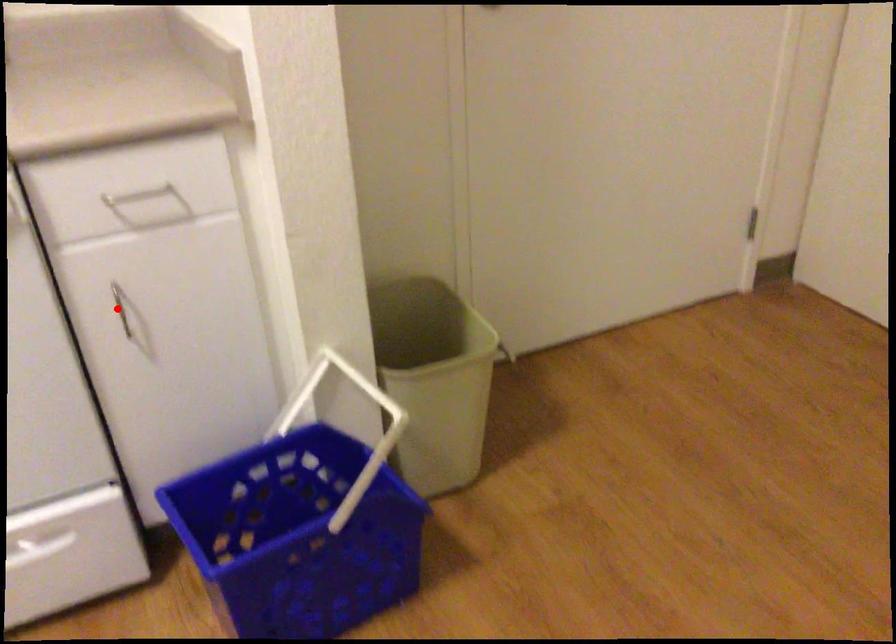
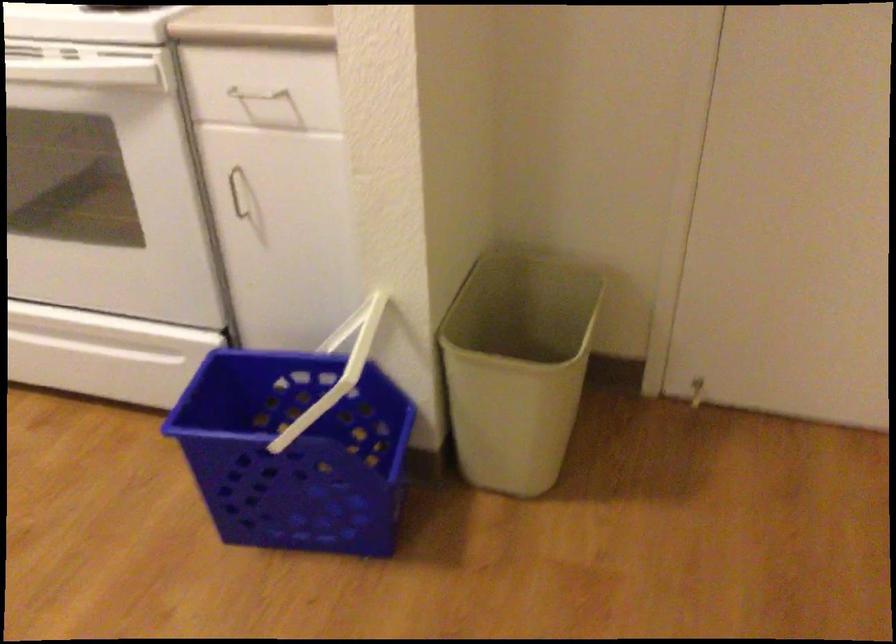
Locate, in the second image, the point that corresponds to the highlighted location in the first image.

(237, 192)